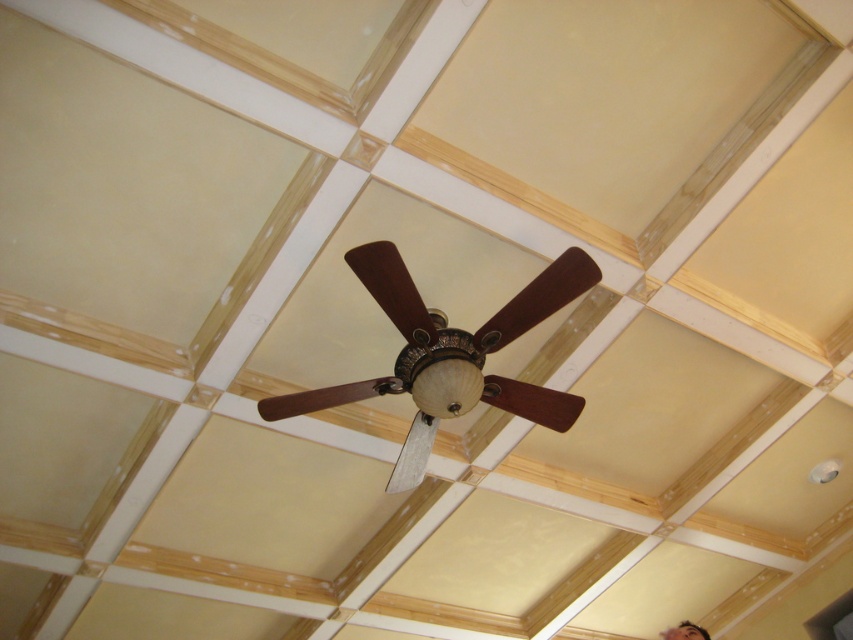
You are an interior designer assessing the proportions of objects in a room. You notice the wooden ceiling fan at center and the smooth skin face at lower right. Which object appears bigger in the image?

The wooden ceiling fan at center has a larger size compared to the smooth skin face at lower right, so the wooden ceiling fan at center appears bigger in the image.

You are standing in a room with the wooden ceiling fan at center. If you want to reach the fan to change its light bulb, and you know your arm can extend 2.5 meters, will you be able to reach it?

The wooden ceiling fan at center is 8.84 feet away from the camera. Since 8.84 feet is approximately 2.69 meters, and your arm can extend 2.5 meters, you will not be able to reach the fan to change the light bulb.

You are standing in a room with a coffered ceiling. There is a point marked at coordinates point (584, 264). If you want to touch this point with a 3 meter long pole, will you be able to reach it?

The point (584, 264) is 2.85 meters away from you, so yes, you can reach it with a 3 meter long pole since it is slightly longer than the distance.